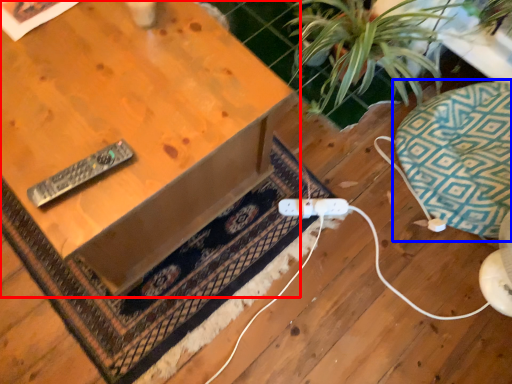
Question: Which point is further to the camera, table (highlighted by a red box) or swivel chair (highlighted by a blue box)?

Choices:
 (A) table
 (B) swivel chair

Answer: (B)